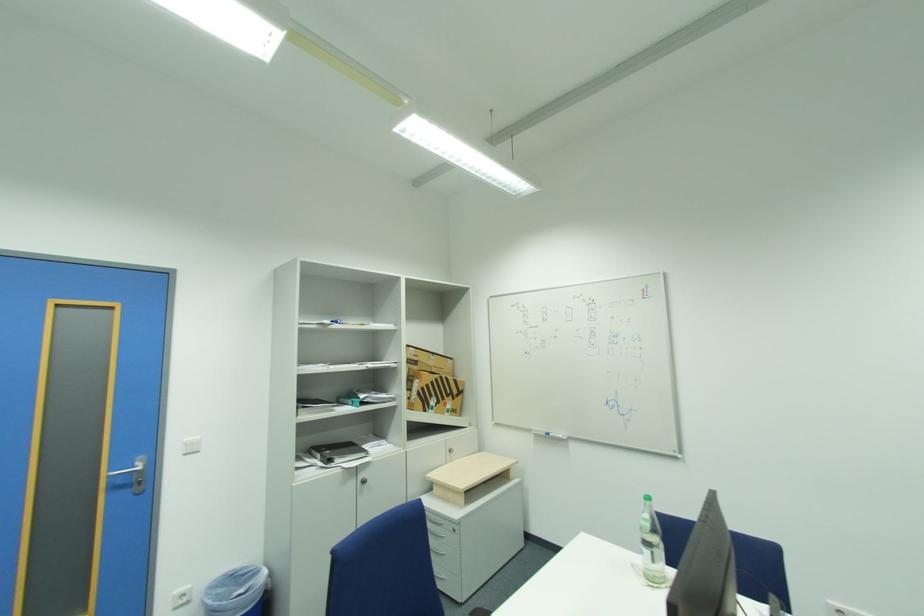
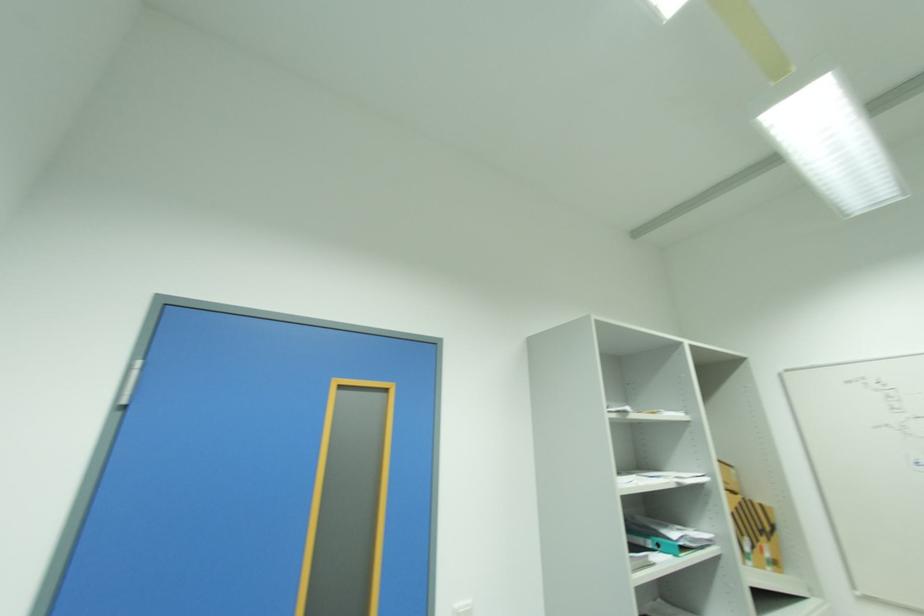
In the second image, find the point that corresponds to (x=442, y=381) in the first image.

(746, 506)